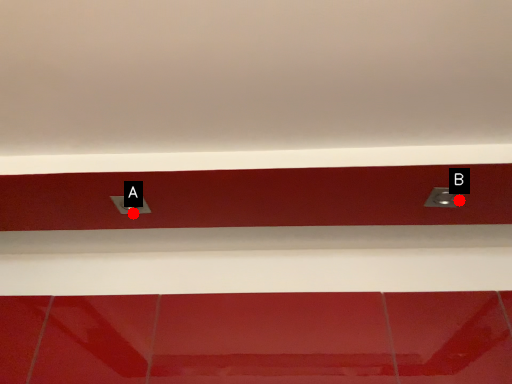
Question: Two points are circled on the image, labeled by A and B beside each circle. Which point is further to the camera?

Choices:
 (A) A is further
 (B) B is further

Answer: (A)